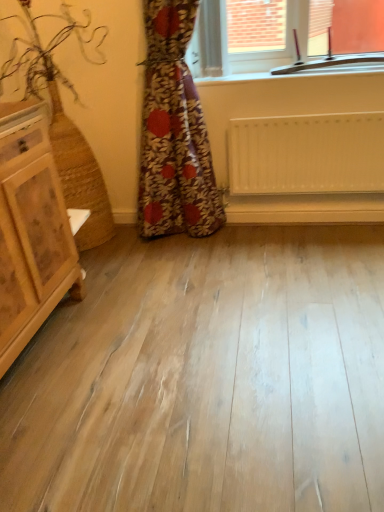
At what (x,y) coordinates should I click in order to perform the action: click on free location in front of floral fabric curtain at center. Please return your answer as a coordinate pair (x, y). The image size is (384, 512). Looking at the image, I should click on pos(198,277).